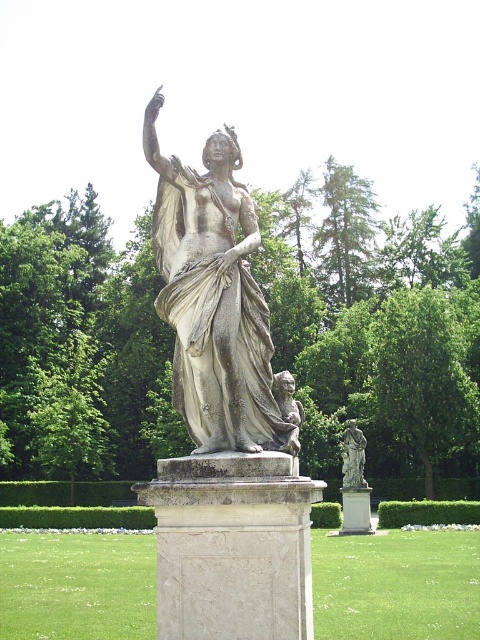
You are a visitor in the garden and want to take a photo of both the matte gray statue at center and the white marble statue at center. Which statue should you position closer to the camera to ensure both are visible in the frame?

You should position the matte gray statue at center closer to the camera since it is already in front of the white marble statue at center, allowing both to be captured in the frame without obstruction.

You are a landscape architect designing a pathway around the garden. You need to ensure that the pathway does not block the view of the matte gray statue at center from the white marble pillar at center. Is the current placement of the statue and pillar allowing for an unobstructed view between them?

The matte gray statue at center is above the white marble pillar at center, so the statue is positioned on top of the pillar. This means there is a clear, unobstructed view between them as the statue sits atop the pillar without any obstruction.

Looking at this image, you are an art student who wants to create a scale model of the statue in the garden. You have two statues in the image, the matte gray statue at center and the white marble statue at center. Which one should you choose if you want your model to be as large as possible?

The matte gray statue at center has a larger size compared to the white marble statue at center, so you should choose the matte gray statue at center to create the largest possible scale model.